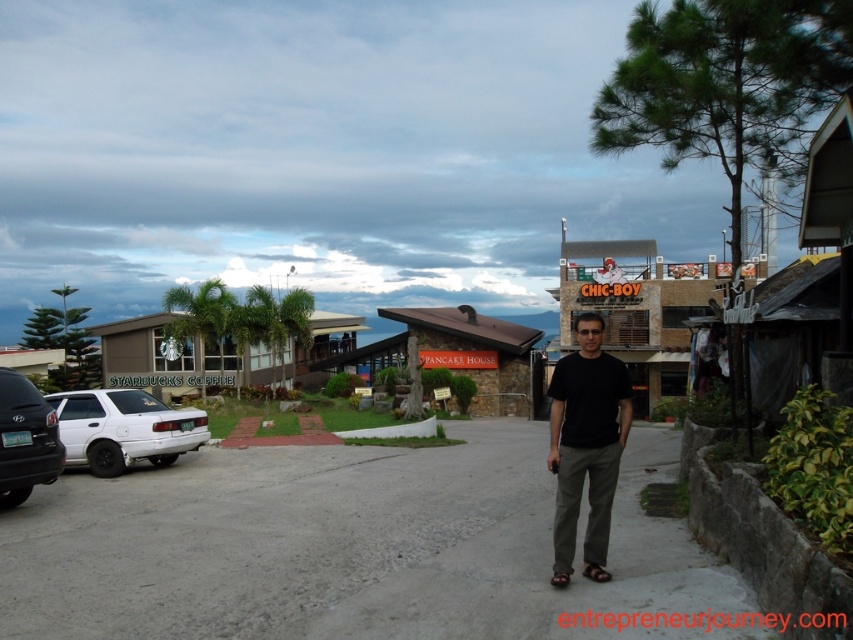
Question: Among these objects, which one is nearest to the camera?

Choices:
 (A) matte black car at left
 (B) brown leather sandal at center
 (C) brown leather sandal at lower right
 (D) white matte sedan at lower left

Answer: (C)

Question: Can you confirm if black matte shirt at center is thinner than matte black car at left?

Choices:
 (A) no
 (B) yes

Answer: (A)

Question: Which point is closer to the camera?

Choices:
 (A) matte black car at left
 (B) brown leather sandal at center

Answer: (B)

Question: Which point is farther from the camera taking this photo?

Choices:
 (A) (24, 401)
 (B) (573, 355)

Answer: (A)

Question: Does white matte sedan at lower left appear over brown leather sandal at lower right?

Choices:
 (A) no
 (B) yes

Answer: (A)

Question: In this image, where is black matte shirt at center located relative to white matte sedan at lower left?

Choices:
 (A) right
 (B) left

Answer: (A)